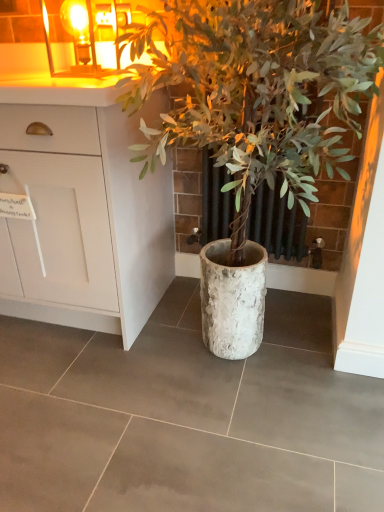
Question: Is white textured pot at center not within amber glass candle at upper left?

Choices:
 (A) no
 (B) yes

Answer: (B)

Question: Can you confirm if white textured pot at center is shorter than amber glass candle at upper left?

Choices:
 (A) yes
 (B) no

Answer: (B)

Question: Does white textured pot at center contain amber glass candle at upper left?

Choices:
 (A) no
 (B) yes

Answer: (A)

Question: Is white textured pot at center positioned with its back to amber glass candle at upper left?

Choices:
 (A) yes
 (B) no

Answer: (B)

Question: From the image's perspective, would you say white textured pot at center is positioned over amber glass candle at upper left?

Choices:
 (A) no
 (B) yes

Answer: (A)

Question: Is white textured pot at center closer to the viewer compared to amber glass candle at upper left?

Choices:
 (A) no
 (B) yes

Answer: (B)

Question: Is white matte cabinet at upper left with amber glass candle at upper left?

Choices:
 (A) yes
 (B) no

Answer: (B)

Question: Is white matte cabinet at upper left located outside amber glass candle at upper left?

Choices:
 (A) yes
 (B) no

Answer: (A)

Question: From the image's perspective, does white matte cabinet at upper left appear lower than amber glass candle at upper left?

Choices:
 (A) yes
 (B) no

Answer: (A)

Question: Is white matte cabinet at upper left thinner than amber glass candle at upper left?

Choices:
 (A) no
 (B) yes

Answer: (A)

Question: Does white matte cabinet at upper left have a smaller size compared to amber glass candle at upper left?

Choices:
 (A) yes
 (B) no

Answer: (B)

Question: Does white matte cabinet at upper left have a greater width compared to amber glass candle at upper left?

Choices:
 (A) no
 (B) yes

Answer: (B)

Question: From the image's perspective, is white matte cabinet at upper left over white textured pot at center?

Choices:
 (A) no
 (B) yes

Answer: (B)